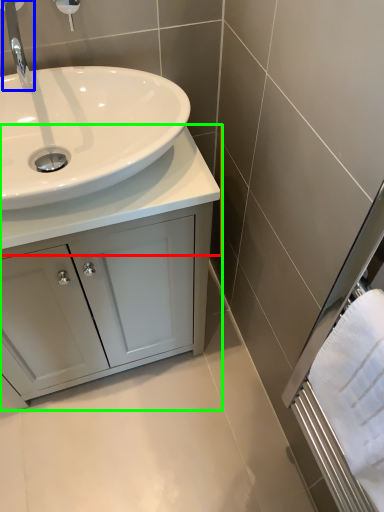
Question: Considering the real-world distances, which object is closest to counter top (highlighted by a red box)? tap (highlighted by a blue box) or bathroom cabinet (highlighted by a green box).

Choices:
 (A) tap
 (B) bathroom cabinet

Answer: (B)